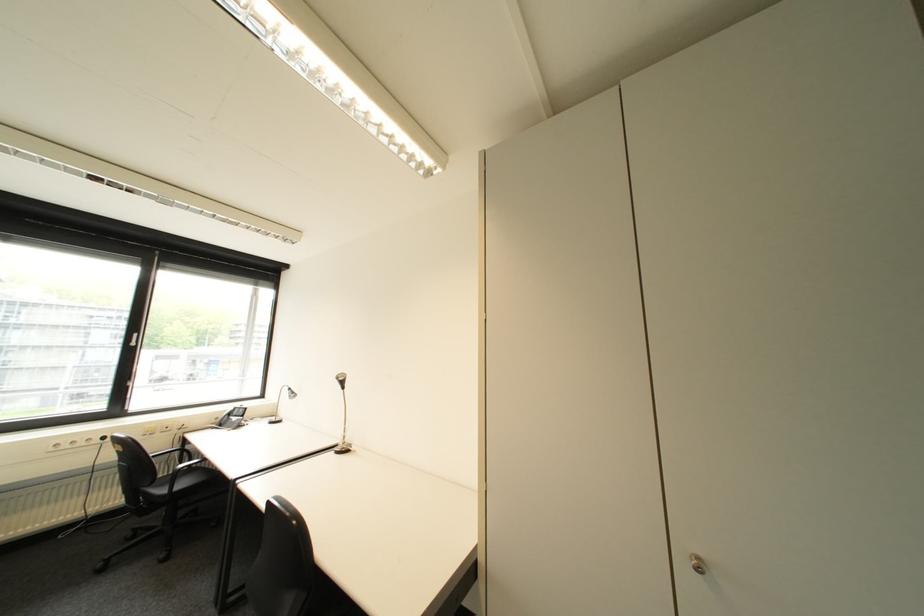
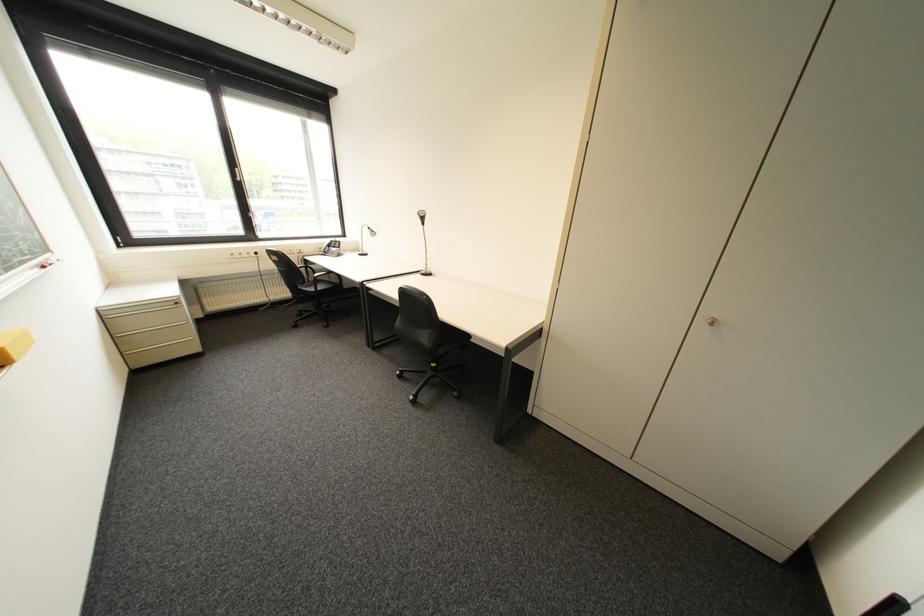
Where in the second image is the point corresponding to [140,536] from the first image?

(309, 314)